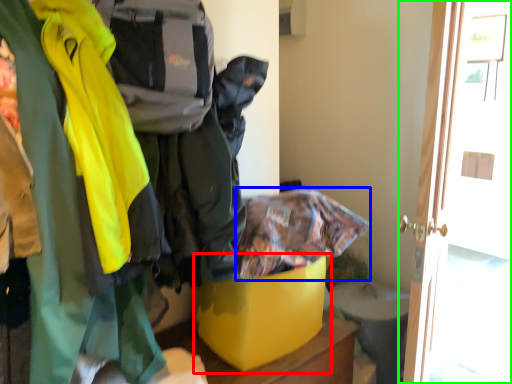
Question: Estimate the real-world distances between objects in this image. Which object is farther from storage box (highlighted by a red box), cloak (highlighted by a blue box) or door (highlighted by a green box)?

Choices:
 (A) cloak
 (B) door

Answer: (B)